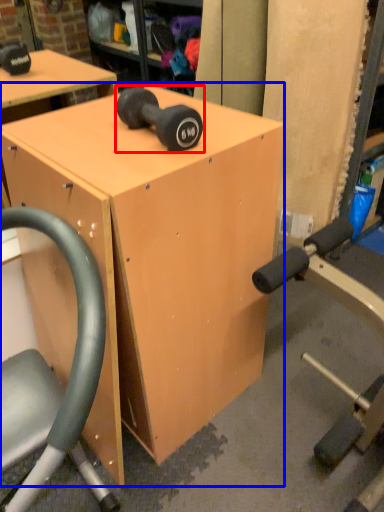
Question: Among these objects, which one is nearest to the camera, dumbbell (highlighted by a red box) or table (highlighted by a blue box)?

Choices:
 (A) dumbbell
 (B) table

Answer: (B)